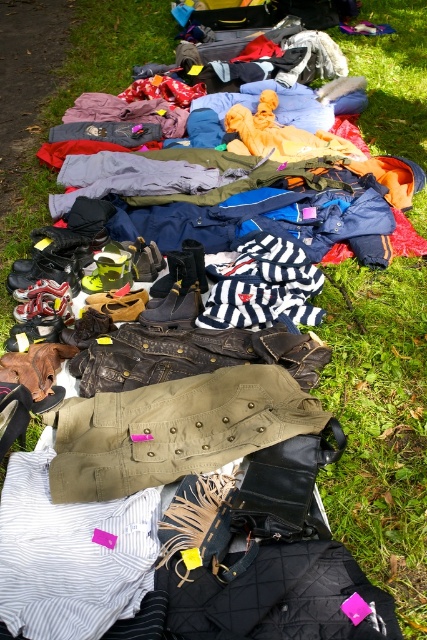
Question: Among these objects, which one is nearest to the camera?

Choices:
 (A) striped cotton shirt at center
 (B) khaki cotton jacket at center

Answer: (A)

Question: Is khaki cotton jacket at center bigger than striped cotton shirt at center?

Choices:
 (A) no
 (B) yes

Answer: (B)

Question: Is khaki cotton jacket at center behind striped cotton shirt at center?

Choices:
 (A) yes
 (B) no

Answer: (A)

Question: Which of the following is the farthest from the observer?

Choices:
 (A) striped cotton shirt at center
 (B) khaki cotton jacket at center

Answer: (B)

Question: Does khaki cotton jacket at center have a smaller size compared to striped cotton shirt at center?

Choices:
 (A) yes
 (B) no

Answer: (B)